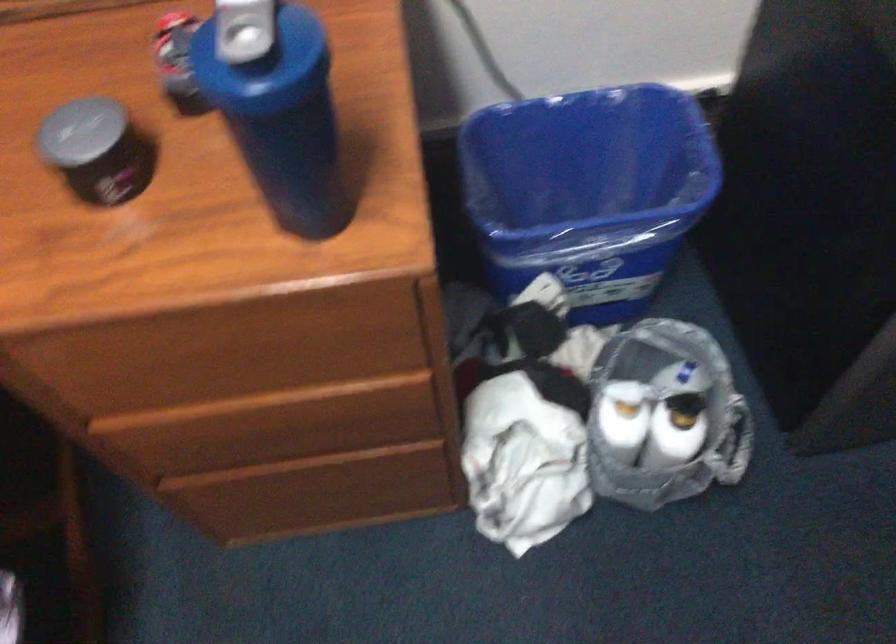
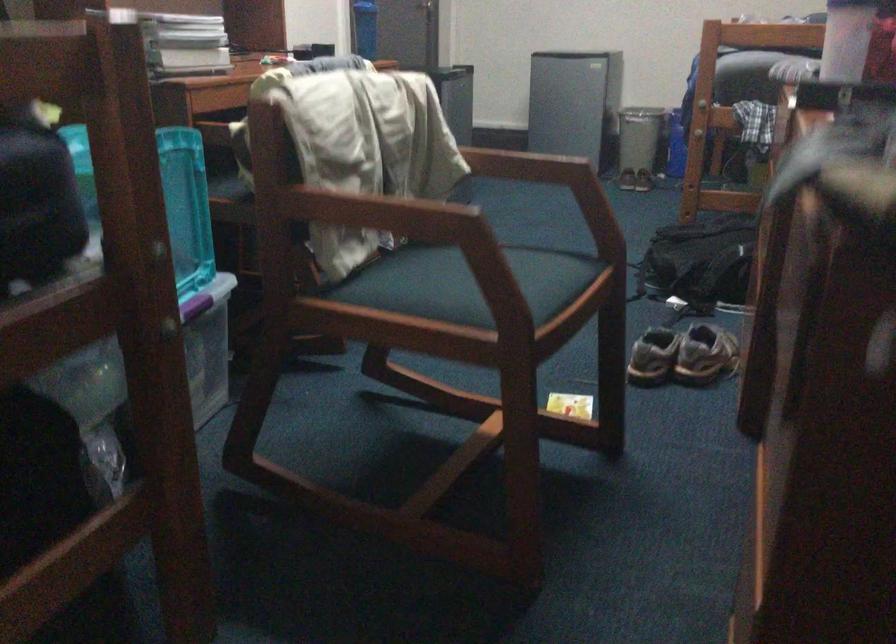
Question: I am providing you with two images of the same scene from different viewpoints. Which of the following objects are not visible in image2?

Choices:
 (A) colorful fridge magnet
 (B) white bottle
 (C) wooden chair armrest
 (D) pair of sneakers

Answer: (B)